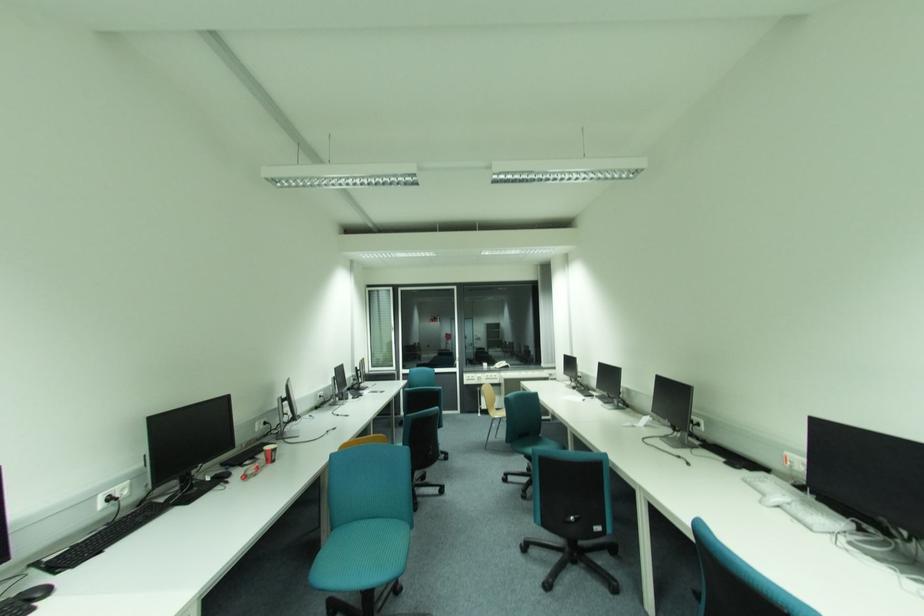
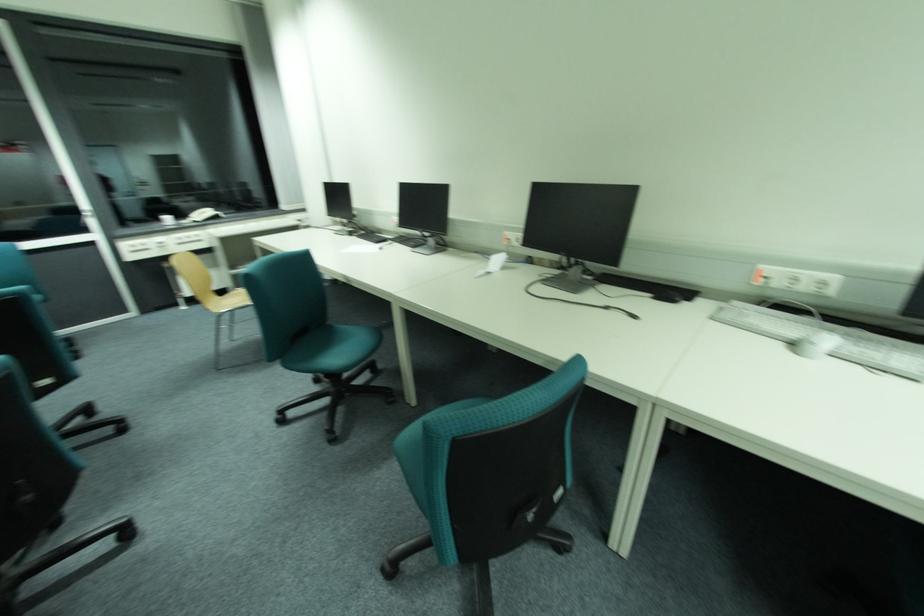
The point at (x=776, y=476) is marked in the first image. Where is the corresponding point in the second image?

(743, 304)